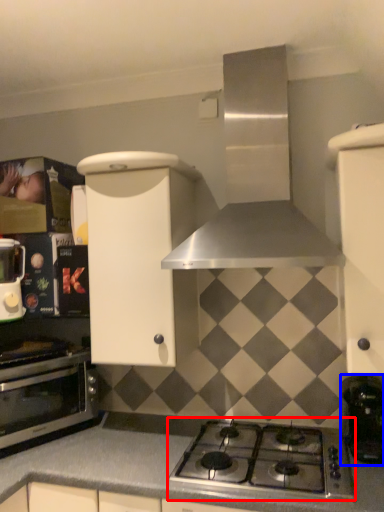
Question: Which of the following is the farthest to the observer, gas stove (highlighted by a red box) or coffee machine (highlighted by a blue box)?

Choices:
 (A) gas stove
 (B) coffee machine

Answer: (B)